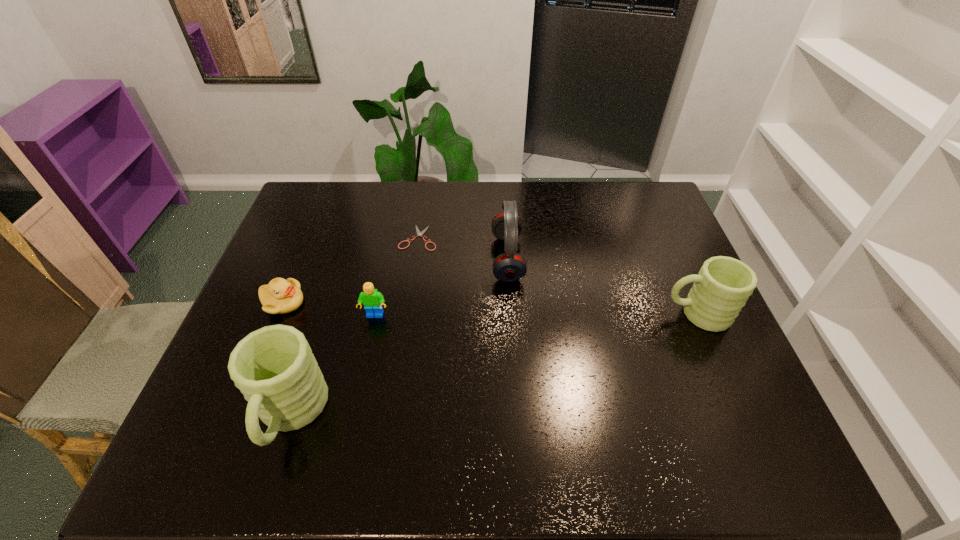
The image size is (960, 540). I want to click on the second closest object to the fourth shortest object, so click(x=419, y=233).

Locate an element on the screen. The height and width of the screenshot is (540, 960). free location that satisfies the following two spatial constraints: 1. on the ear cups of the second object from right to left; 2. on the face of the third shortest object is located at coordinates (511, 316).

Find the location of a particular element. This screenshot has width=960, height=540. free location that satisfies the following two spatial constraints: 1. on the ear cups of the fifth object from left to right; 2. on the face of the fourth tallest object is located at coordinates (511, 316).